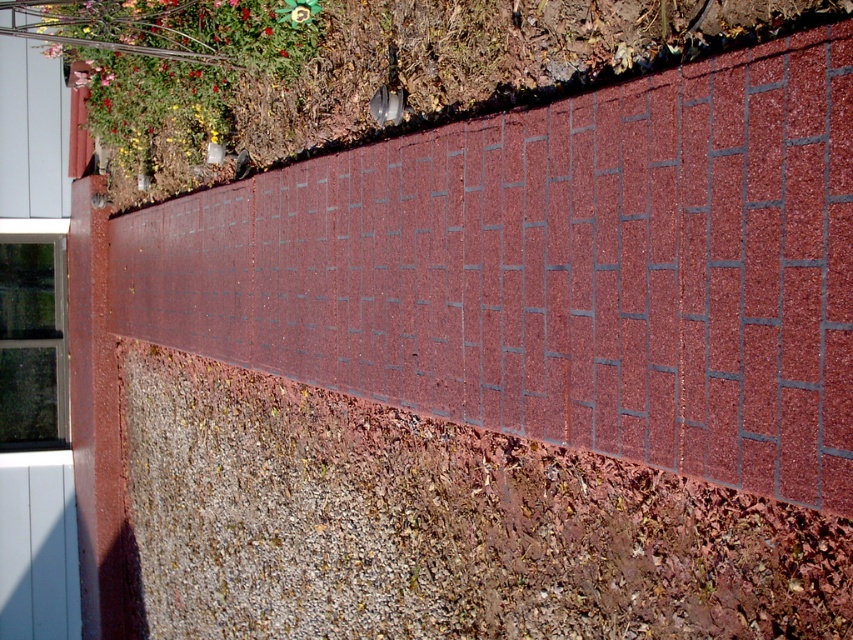
You are standing on the pathway and want to place a small potted plant between the brick at center and the green leafy plant at upper left. Which object should you place the potted plant closer to if you want it to be shorter than both?

The brick at center has a lesser height compared to green leafy plant at upper left. Therefore, you should place the potted plant closer to the brick at center to ensure it is shorter than both.

From the picture: You are standing on the pathway and want to take a photo of the brick at center and the green leafy plant at upper left. Which object should you focus on first to ensure both are in the frame without moving the camera?

You should focus on the brick at center first because it is in front of the green leafy plant at upper left, so keeping it centered will allow both to be captured in the frame without needing to adjust the camera position.